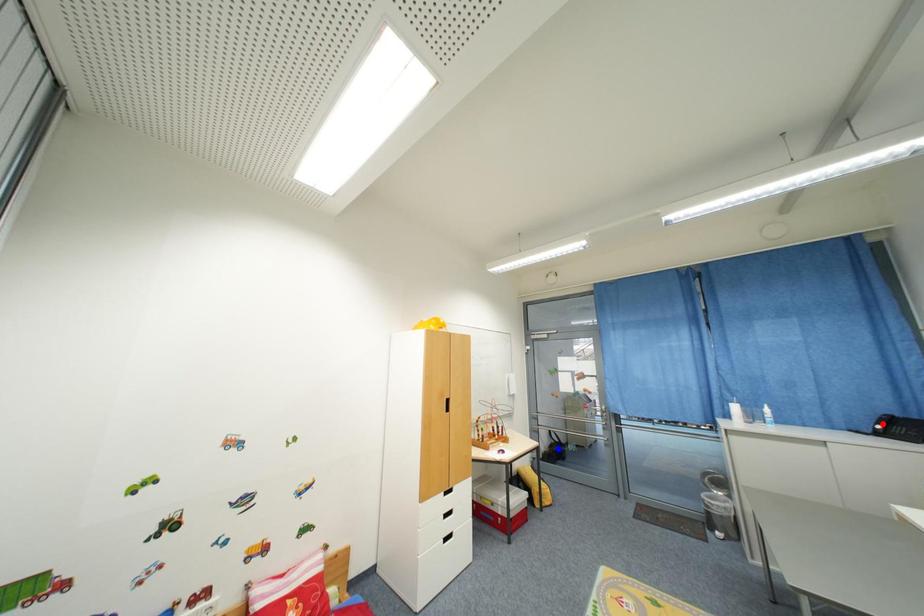
Question: Two points are marked on the image. Which point is closer to the camera?

Choices:
 (A) Blue point is closer.
 (B) Red point is closer.

Answer: (B)